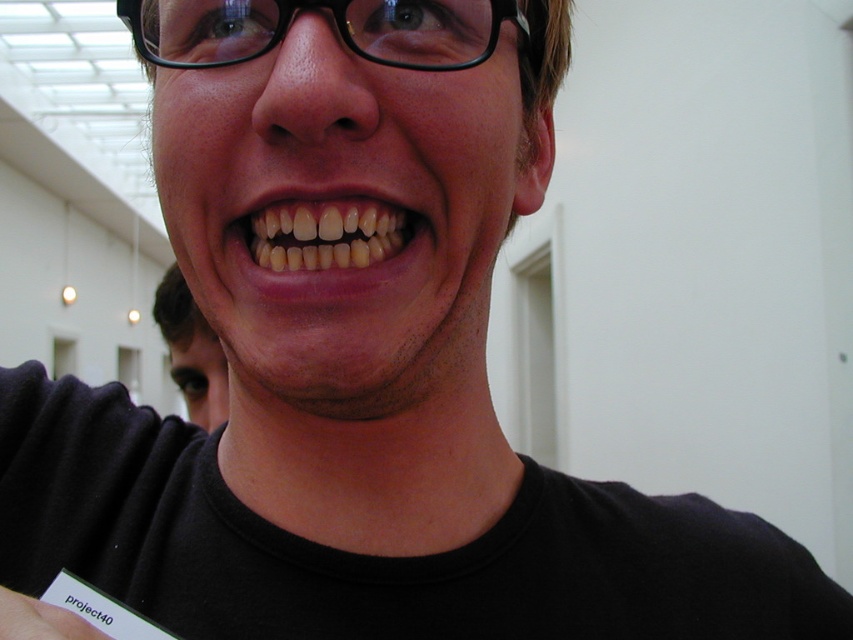
Question: Is matte black shirt at lower left positioned behind white paper at lower left?

Choices:
 (A) yes
 (B) no

Answer: (A)

Question: Which of the following is the closest to the observer?

Choices:
 (A) (33, 608)
 (B) (387, 241)
 (C) (177, 291)

Answer: (A)

Question: Which object is farther from the camera taking this photo?

Choices:
 (A) natural yellow teeth at center
 (B) matte black shirt at lower left
 (C) white paper at lower left

Answer: (B)

Question: Which of the following is the closest to the observer?

Choices:
 (A) matte black shirt at lower left
 (B) natural yellow teeth at center
 (C) white paper at lower left

Answer: (C)

Question: Is natural yellow teeth at center thinner than matte black shirt at lower left?

Choices:
 (A) no
 (B) yes

Answer: (B)

Question: Can you confirm if natural yellow teeth at center is positioned below white paper at lower left?

Choices:
 (A) yes
 (B) no

Answer: (B)